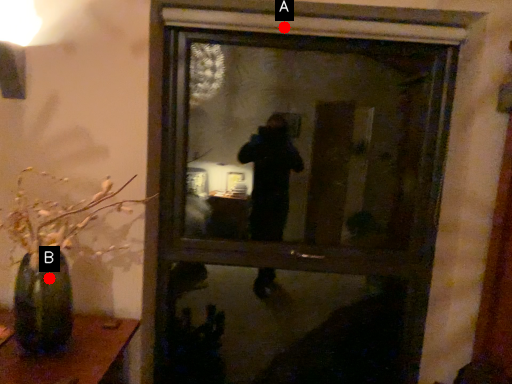
Question: Two points are circled on the image, labeled by A and B beside each circle. Which point appears closest to the camera in this image?

Choices:
 (A) A is closer
 (B) B is closer

Answer: (B)